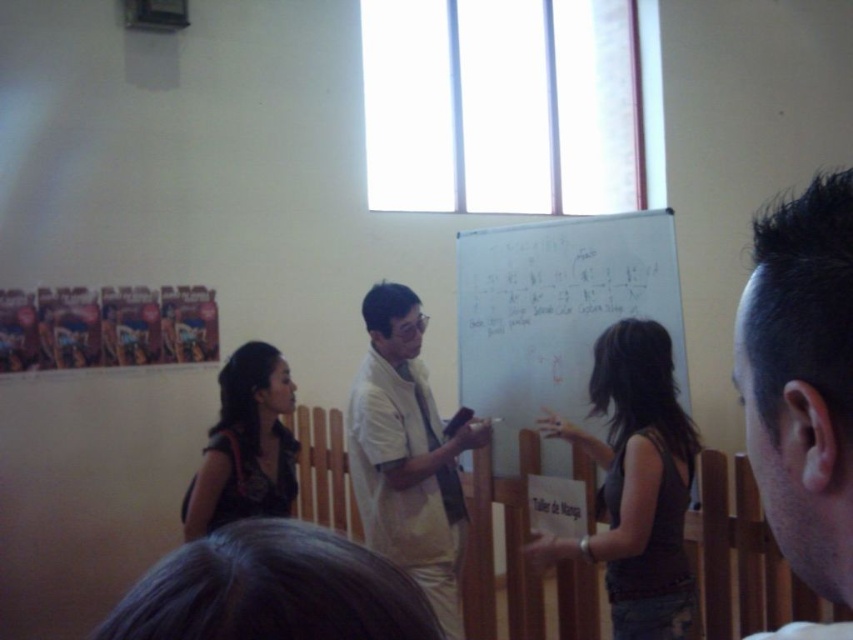
You are a photographer positioned at the camera. You need to capture a closeup shot of the dark brown hair at upper right without moving the camera. Can you adjust the zoom to focus on it effectively?

The dark brown hair at upper right is 18.76 inches away from the camera. Depending on the camera lens capabilities, adjusting the zoom to focus on it might be possible, but the distance is relatively close, so a high zoom might be required.